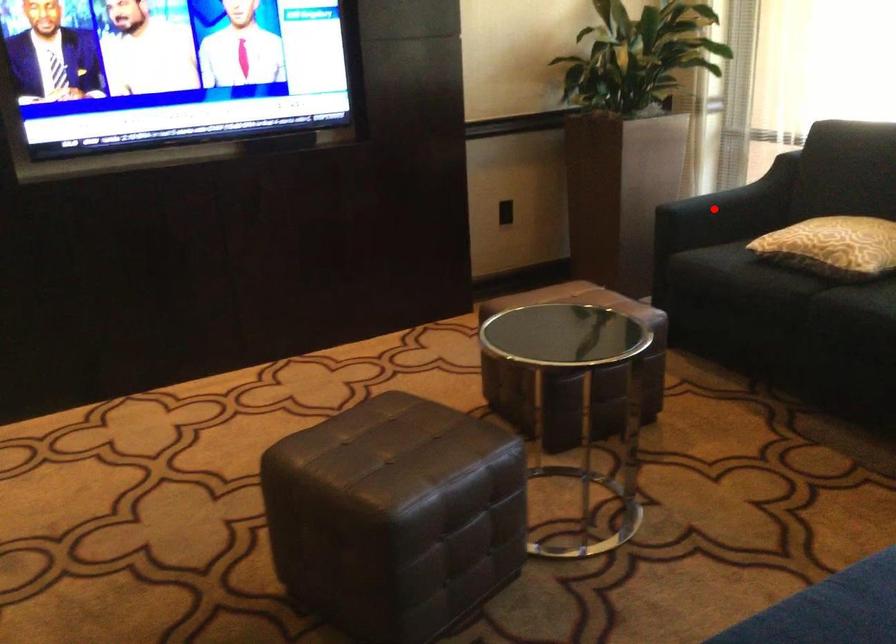
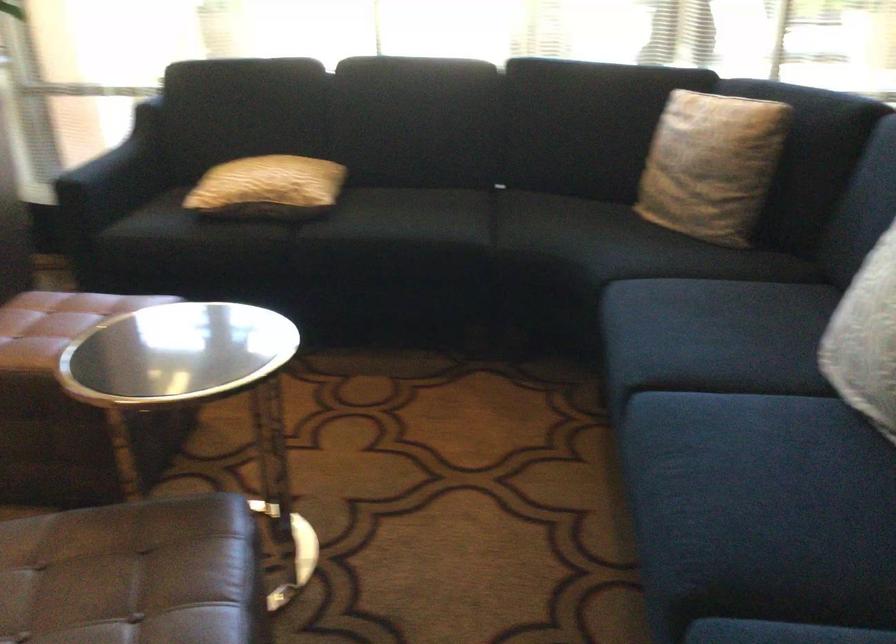
Question: I am providing you with two images of the same scene from different viewpoints. Image1 has a red point marked. In image2, the corresponding 3D location appears at what relative position? Reply with the corresponding letter.

Choices:
 (A) Closer
 (B) Farther

Answer: (A)